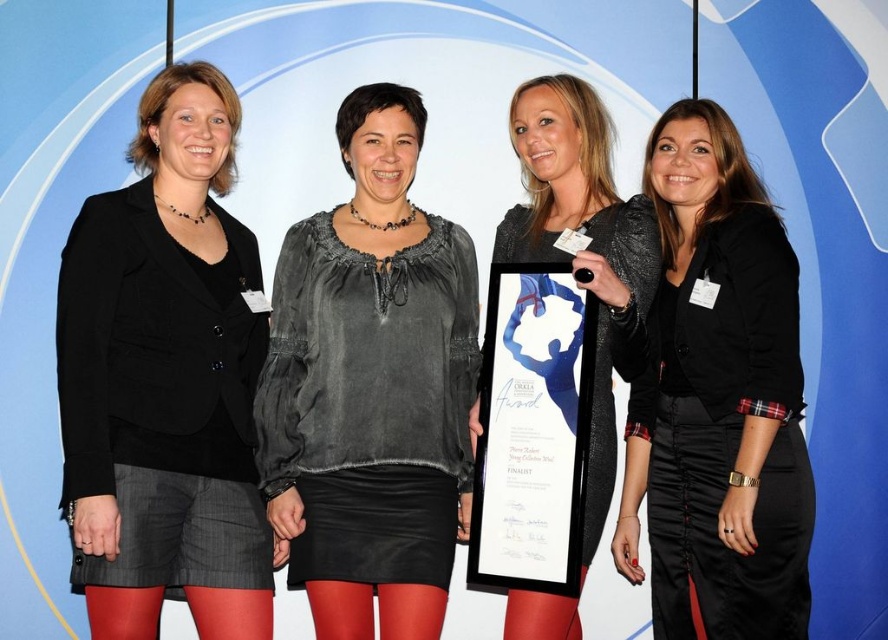
Is matte black blazer at left in front of matte gray blouse at center?

That is True.

Is matte black blazer at left shorter than matte gray blouse at center?

No.

Where is `matte black blazer at left`? matte black blazer at left is located at coordinates (165, 380).

Between point (678, 147) and point (585, 192), which one is positioned in front?

Point (678, 147) is more forward.

Is black satin blazer at center smaller than matte black dress at center?

Yes.

Who is more forward, (712, 486) or (649, 266)?

Point (712, 486)

Where is `black satin blazer at center`? black satin blazer at center is located at coordinates (718, 400).

Does matte gray blouse at center appear on the right side of matte black dress at center?

No, matte gray blouse at center is not to the right of matte black dress at center.

Is matte gray blouse at center to the left of matte black dress at center from the viewer's perspective?

Correct, you'll find matte gray blouse at center to the left of matte black dress at center.

Is point (274, 477) behind point (601, 298)?

Yes, point (274, 477) is behind point (601, 298).

I want to click on matte gray blouse at center, so [x=371, y=387].